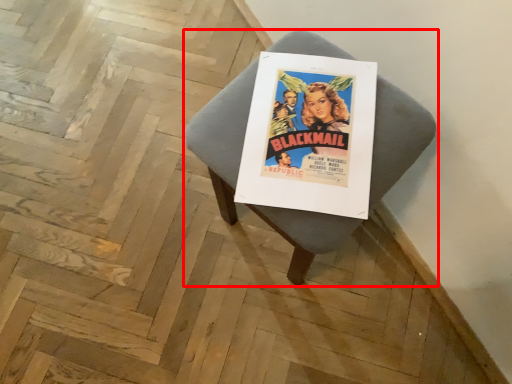
Question: From the image's perspective, considering the relative positions of furniture (annotated by the red box) and poster in the image provided, where is furniture (annotated by the red box) located with respect to the staircase?

Choices:
 (A) above
 (B) below

Answer: (B)